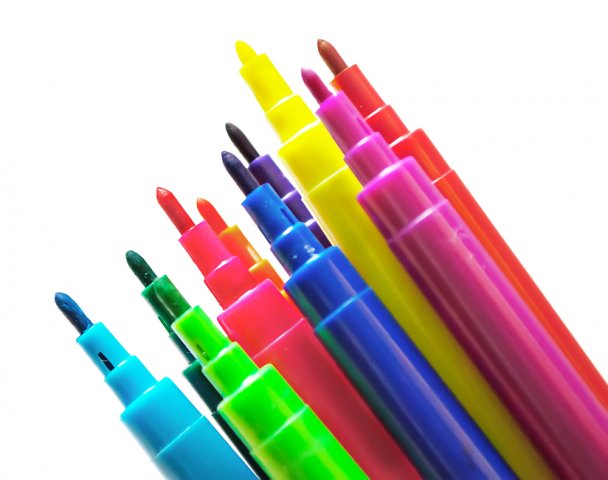
In order to click on markers in this screenshot , I will do `click(137, 384)`, `click(240, 377)`, `click(154, 303)`, `click(233, 298)`, `click(243, 249)`, `click(318, 283)`, `click(297, 203)`, `click(314, 184)`, `click(407, 211)`, `click(423, 146)`.